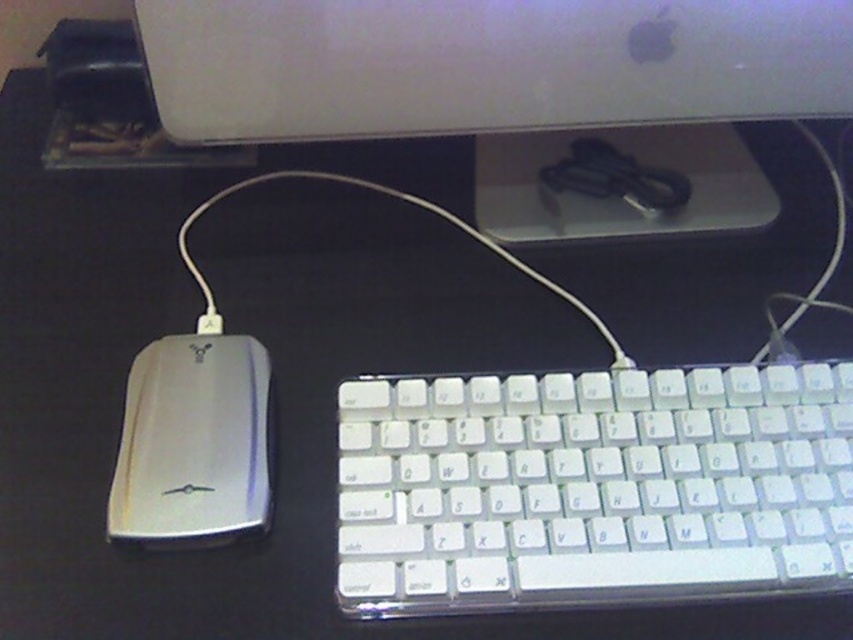
Question: Which is nearer to the silver metallic mouse at left?

Choices:
 (A) white cable at lower left
 (B) white plastic keyboard at lower center

Answer: (A)

Question: Does white plastic keyboard at lower center appear on the right side of silver metallic mouse at left?

Choices:
 (A) yes
 (B) no

Answer: (A)

Question: Among these objects, which one is farthest from the camera?

Choices:
 (A) silver metallic mouse at left
 (B) white plastic keyboard at lower center
 (C) white cable at lower left

Answer: (C)

Question: Is satin white monitor at upper center to the right of silver metallic mouse at left from the viewer's perspective?

Choices:
 (A) yes
 (B) no

Answer: (A)

Question: Which of the following is the farthest from the observer?

Choices:
 (A) (256, 426)
 (B) (355, 502)
 (C) (596, 324)
 (D) (646, 22)

Answer: (C)

Question: Is satin white monitor at upper center positioned behind silver metallic mouse at left?

Choices:
 (A) yes
 (B) no

Answer: (A)